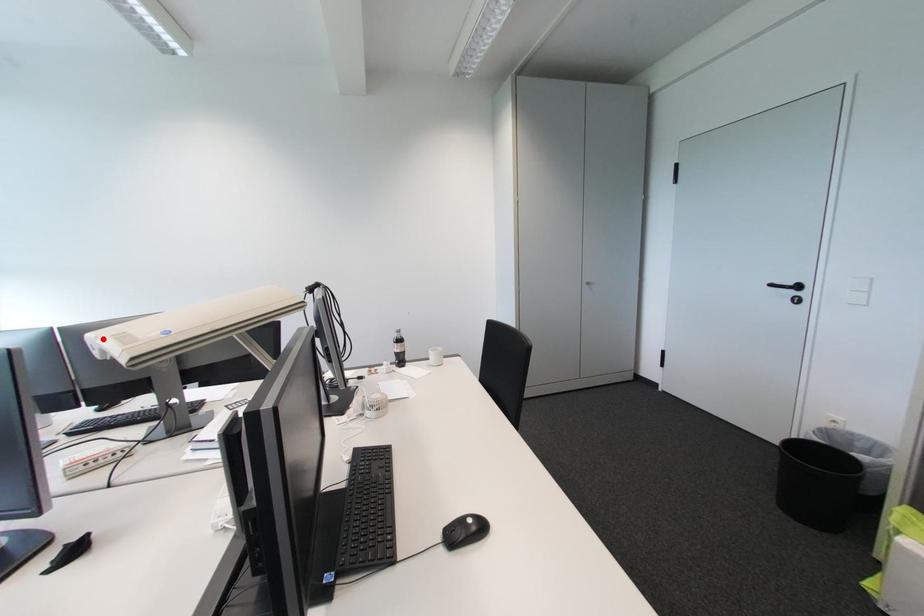
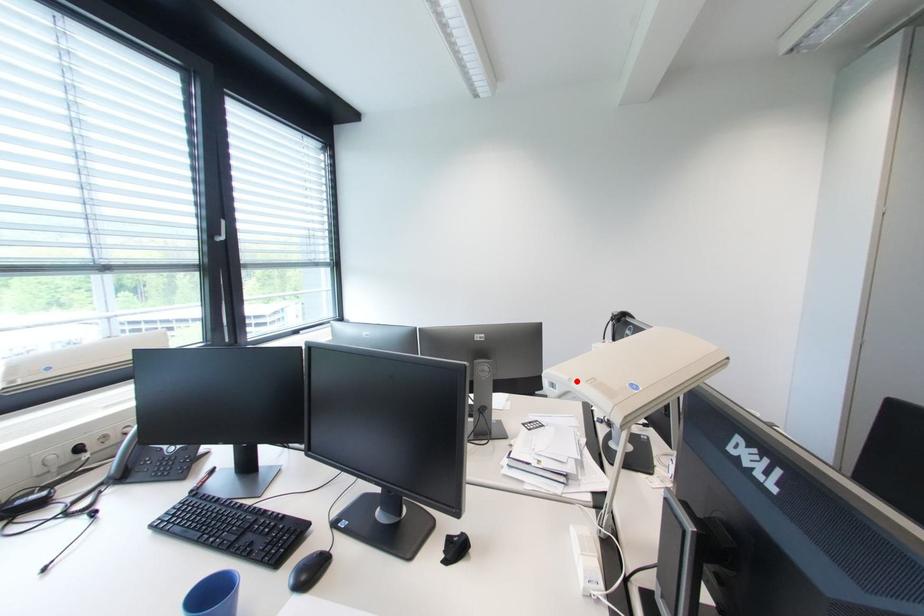
Consider the image. I am providing you with two images of the same scene from different viewpoints. A red point is marked on the first image and another point is marked on the second image. Are the points marked in image1 and image2 representing the same 3D position?

Yes